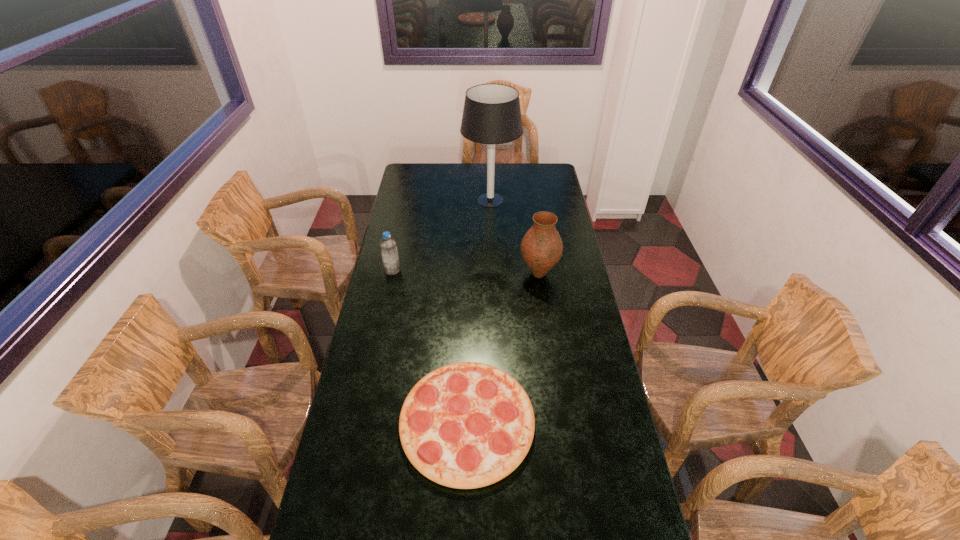
Find the location of `vacant space in between the vase and the water bottle`. vacant space in between the vase and the water bottle is located at coordinates (466, 272).

The image size is (960, 540). Find the location of `free space that is in between the vase and the water bottle`. free space that is in between the vase and the water bottle is located at coordinates (466, 272).

Image resolution: width=960 pixels, height=540 pixels. I want to click on free space between the tallest object and the leftmost object, so click(442, 235).

Identify the location of unoccupied position between the shortest object and the second tallest object. The width and height of the screenshot is (960, 540). (503, 348).

The height and width of the screenshot is (540, 960). In order to click on empty space that is in between the farthest object and the third shortest object in this screenshot , I will do `click(515, 237)`.

Locate an element on the screen. The height and width of the screenshot is (540, 960). free space between the nearest object and the second tallest object is located at coordinates (503, 348).

Where is `empty space between the leftmost object and the shortest object`? The height and width of the screenshot is (540, 960). empty space between the leftmost object and the shortest object is located at coordinates (430, 346).

You are a GUI agent. You are given a task and a screenshot of the screen. Output one action in this format:
    pyautogui.click(x=<x>, y=<y>)
    Task: Click on the vacant space in between the vase and the tallest object
    Image resolution: width=960 pixels, height=540 pixels.
    Given the screenshot: What is the action you would take?
    pyautogui.click(x=515, y=237)

At what (x,y) coordinates should I click in order to perform the action: click on empty space between the shortest object and the leftmost object. Please return your answer as a coordinate pair (x, y). Looking at the image, I should click on (430, 346).

Image resolution: width=960 pixels, height=540 pixels. What are the coordinates of `object that is the closest to the tallest object` in the screenshot? It's located at (541, 248).